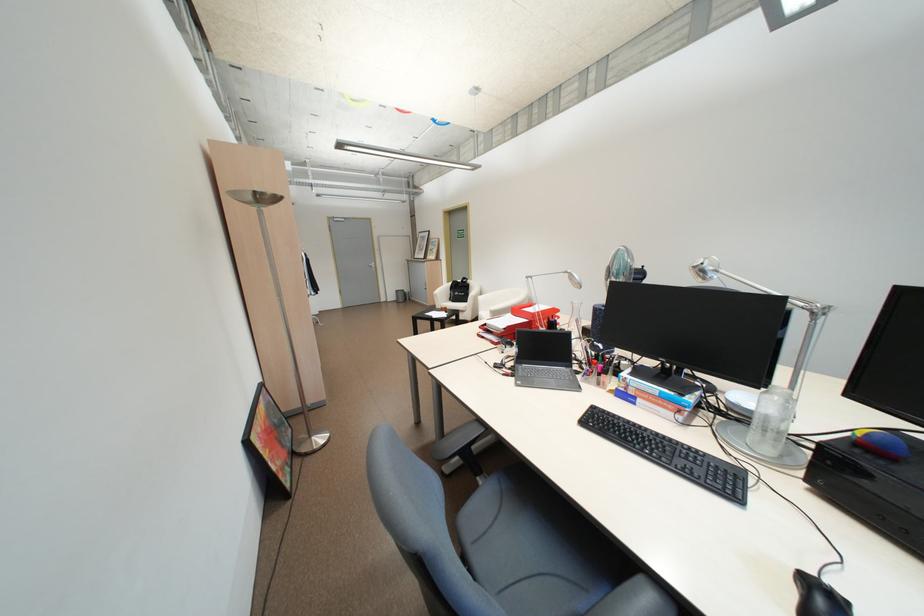
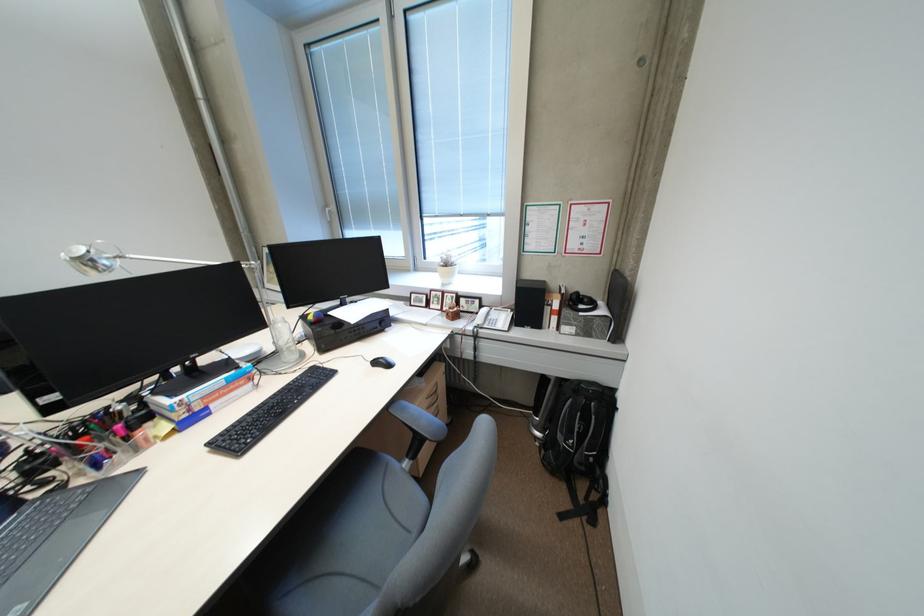
Question: I am providing you with two images of the same scene from different viewpoints. Please identify which objects are invisible in image2.

Choices:
 (A) black receiver dial
 (B) black backpack
 (C) black headphones
 (D) none of these

Answer: (D)